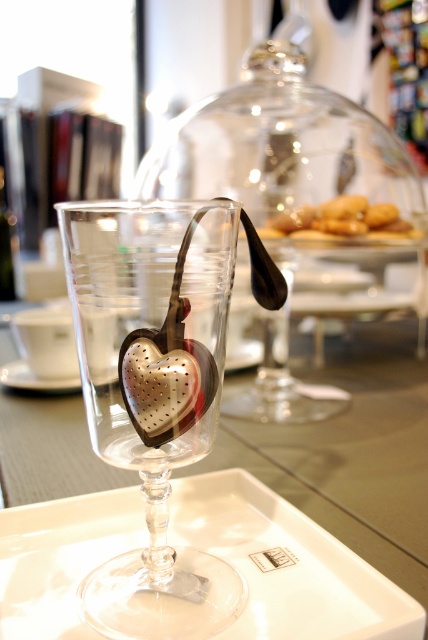
Question: Which point is farther to the camera?

Choices:
 (A) (424, 612)
 (B) (392, 227)
 (C) (95, 417)

Answer: (B)

Question: Is clear glass wine glass at center wider than golden brown cookie at center?

Choices:
 (A) yes
 (B) no

Answer: (B)

Question: Is clear glass wine glass at center to the left of satin silver heart at center from the viewer's perspective?

Choices:
 (A) no
 (B) yes

Answer: (B)

Question: Is clear glass wine glass at center smaller than satin silver heart at center?

Choices:
 (A) yes
 (B) no

Answer: (B)

Question: Which object appears closest to the camera in this image?

Choices:
 (A) white glossy tray at center
 (B) satin silver heart at center
 (C) clear glass wine glass at center

Answer: (C)

Question: Which point is farther from the camera taking this photo?

Choices:
 (A) (351, 198)
 (B) (163, 388)

Answer: (A)